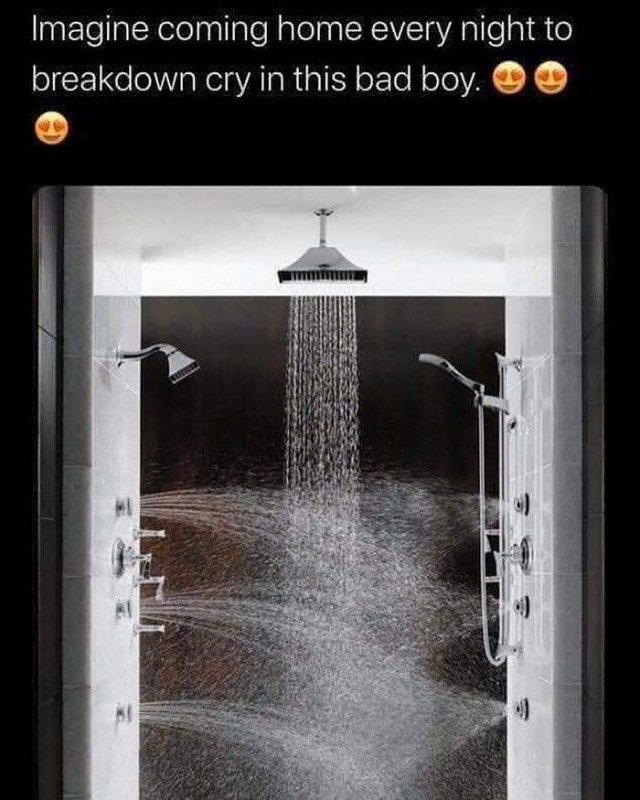
I want to click on shower head above, so click(x=321, y=233).